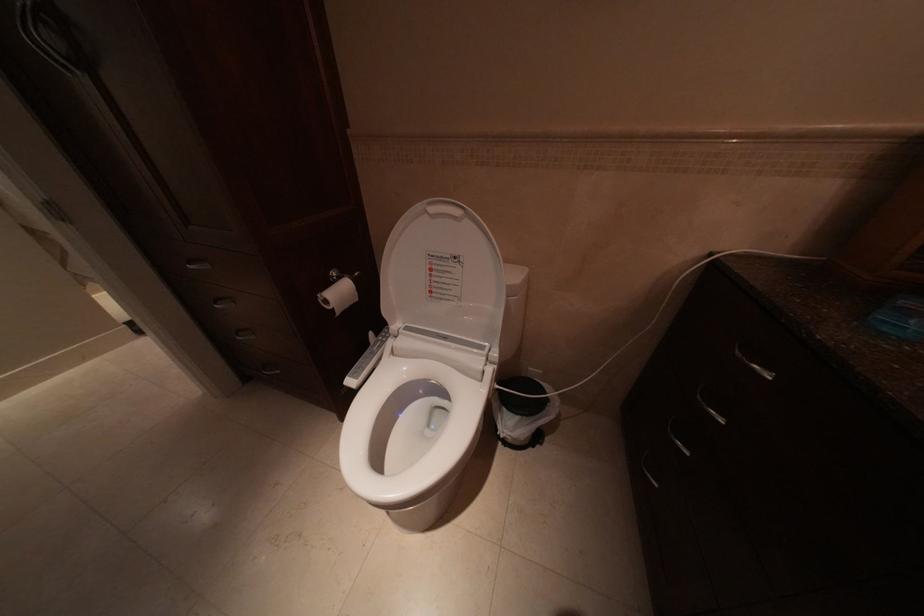
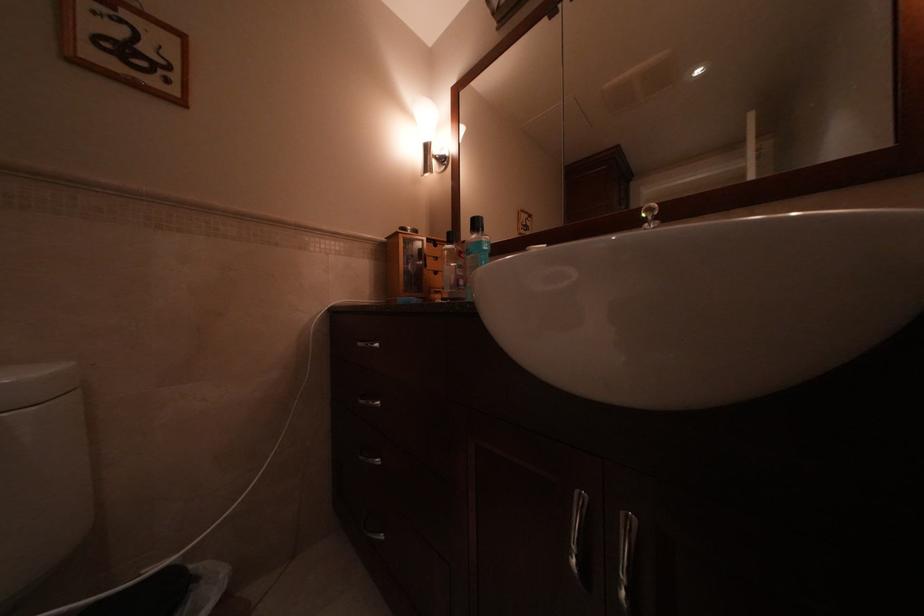
Question: The camera is either moving clockwise (left) or counter-clockwise (right) around the object. The first image is from the beginning of the video and the second image is from the end. Is the camera moving left or right when shooting the video?

Choices:
 (A) Left
 (B) Right

Answer: (A)